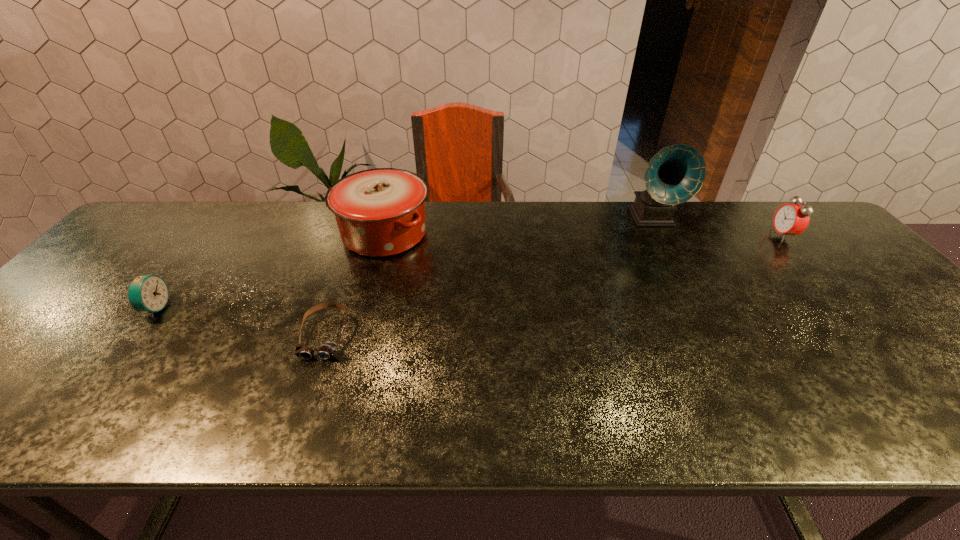
The image size is (960, 540). I want to click on vacant space at the far edge of the desktop, so pos(635,235).

In the image, there is a desktop. Where is `vacant space at the near edge`? The width and height of the screenshot is (960, 540). vacant space at the near edge is located at coordinates (165, 402).

Locate an element on the screen. vacant space at the left edge of the desktop is located at coordinates (69, 343).

I want to click on vacant area at the right edge, so pyautogui.click(x=956, y=393).

Locate an element on the screen. This screenshot has height=540, width=960. vacant space at the far left corner of the desktop is located at coordinates (150, 244).

Find the location of a particular element. vacant space at the far right corner of the desktop is located at coordinates (753, 206).

What are the coordinates of `vacant area that lies between the second tallest object and the phonograph_record` in the screenshot? It's located at (518, 226).

Locate an element on the screen. Image resolution: width=960 pixels, height=540 pixels. free area in between the leftmost object and the phonograph_record is located at coordinates (403, 263).

Image resolution: width=960 pixels, height=540 pixels. I want to click on vacant area that lies between the goggles and the second shortest object, so click(240, 321).

Identify the location of free spot between the goggles and the tallest object. (489, 276).